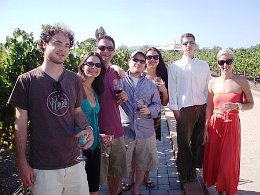
You are a GUI agent. You are given a task and a screenshot of the screen. Output one action in this format:
    pyautogui.click(x=<x>, y=<y>)
    Task: Click on the wine glass
    This screenshot has height=195, width=260.
    Given the screenshot: What is the action you would take?
    pyautogui.click(x=81, y=138)